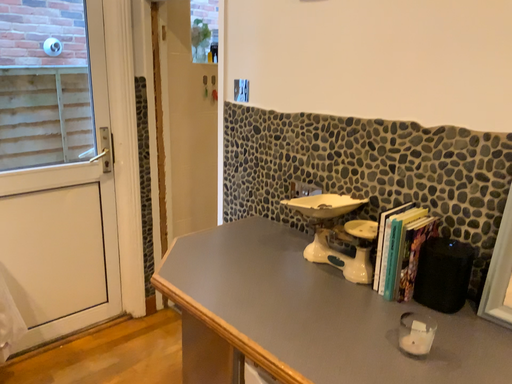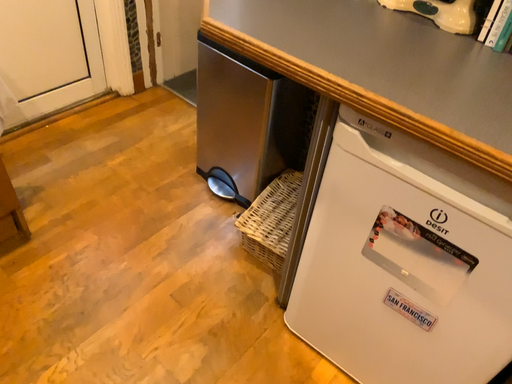
Question: Which way did the camera rotate in the video?

Choices:
 (A) rotated right
 (B) rotated left

Answer: (A)